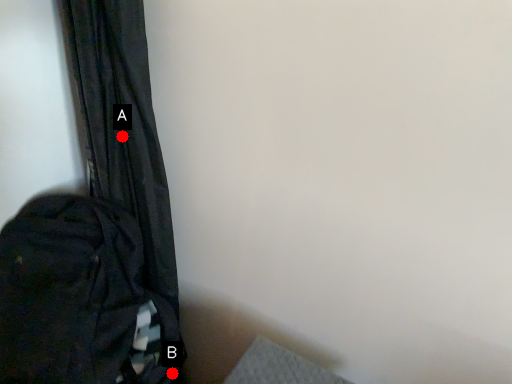
Question: Two points are circled on the image, labeled by A and B beside each circle. Which of the following is the farthest from the observer?

Choices:
 (A) A is further
 (B) B is further

Answer: (B)